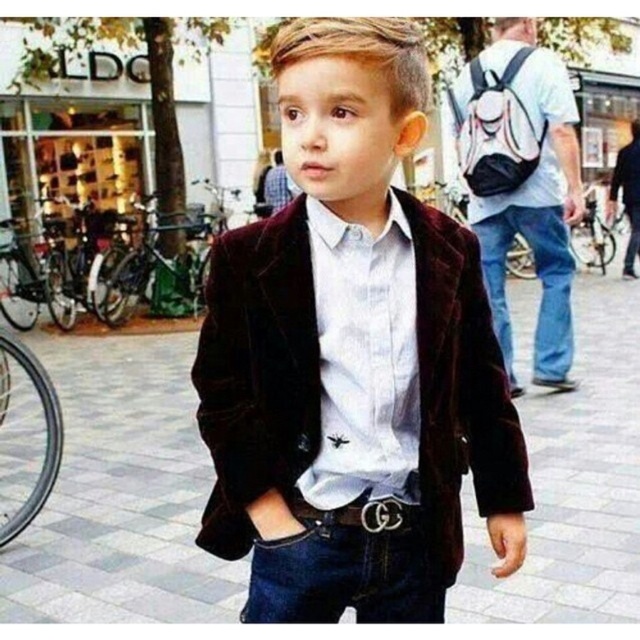
What is the 2D coordinate of the dark gray concrete pavement at center in the image?

The dark gray concrete pavement at center is located at the 2D coordinate point of (122, 493).

You are a fashion designer observing the boy in the image. You need to determine if the white satin shirt at center can be tucked into the blue denim jeans at right based on their lengths. Can it be done?

The white satin shirt at center is shorter than blue denim jeans at right, so it can be tucked in since the shirt is shorter and will not drag below the jeans.